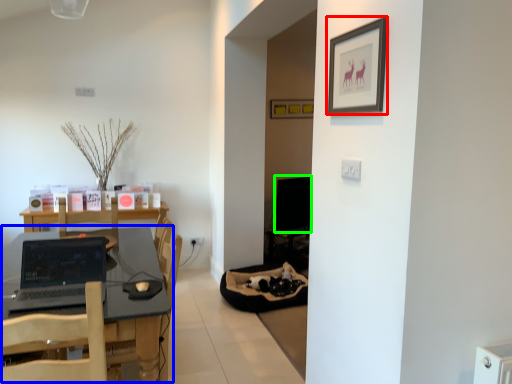
Question: Which is farther away from picture frame (highlighted by a red box)? table (highlighted by a blue box) or computer monitor (highlighted by a green box)?

Choices:
 (A) table
 (B) computer monitor

Answer: (B)